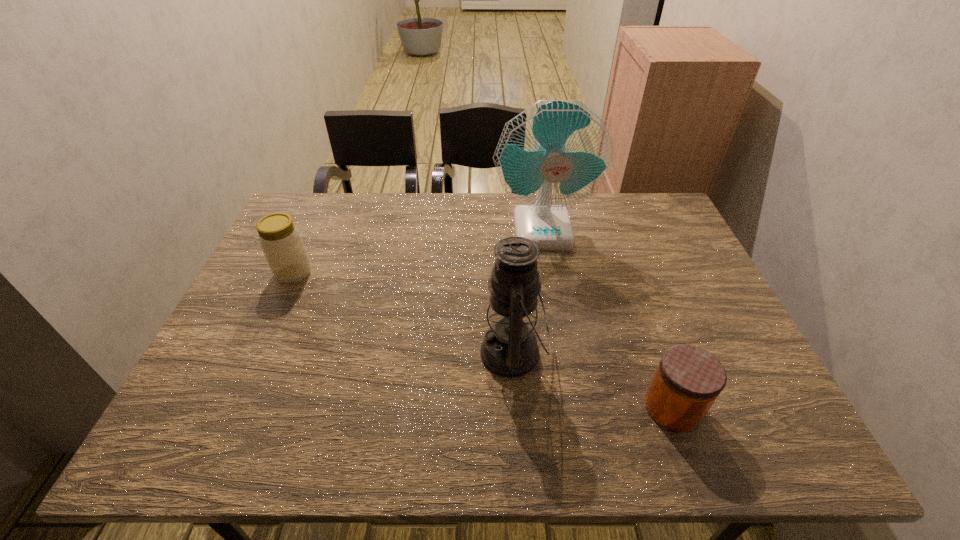
I want to click on the tallest object, so click(557, 153).

I want to click on fan, so click(557, 153).

This screenshot has height=540, width=960. I want to click on oil lamp, so click(x=509, y=349).

Locate an element on the screen. This screenshot has width=960, height=540. the left jar is located at coordinates (280, 240).

The image size is (960, 540). What are the coordinates of `the farther jar` in the screenshot? It's located at (280, 240).

This screenshot has height=540, width=960. What are the coordinates of `the shorter jar` in the screenshot? It's located at (688, 380).

I want to click on the nearer jar, so click(x=688, y=380).

Where is `free space located in front of the fan to face the airflow`? The image size is (960, 540). free space located in front of the fan to face the airflow is located at coordinates tap(562, 341).

Find the location of a particular element. This screenshot has height=540, width=960. vacant space located on the back of the oil lamp is located at coordinates (505, 234).

You are a GUI agent. You are given a task and a screenshot of the screen. Output one action in this format:
    pyautogui.click(x=<x>, y=<y>)
    Task: Click on the vacant region located on the front of the third nearest object
    
    Given the screenshot: What is the action you would take?
    pyautogui.click(x=276, y=313)